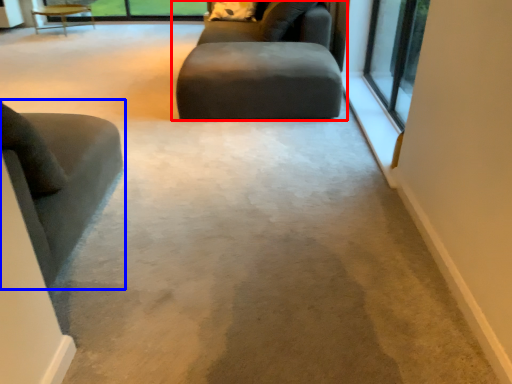
Question: Which of the following is the closest to the observer, studio couch (highlighted by a red box) or chair (highlighted by a blue box)?

Choices:
 (A) studio couch
 (B) chair

Answer: (B)